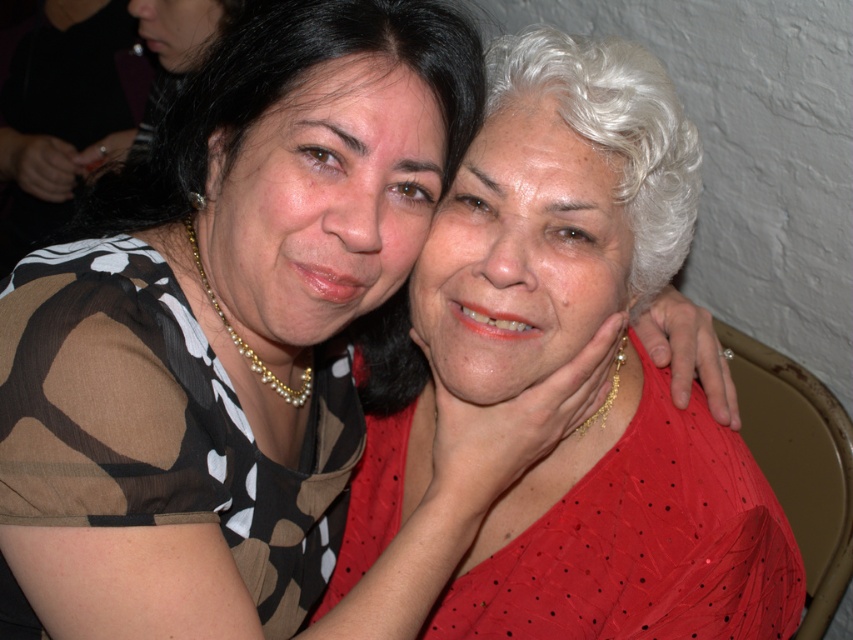
You are a photographer trying to decide where to place a bouquet of flowers in the scene. You want to place it between the brown printed fabric dress at upper left and the red sheer dress at center. Where should you position the bouquet so it is closer to the woman on the right?

The bouquet should be placed closer to the red sheer dress at center since it is positioned on the right side of the brown printed fabric dress at upper left.

Looking at this image, you are a photographer adjusting the focus on your camera. You need to ensure that both points, point (13, 344) and point (393, 449), are in sharp focus. Which point should you focus on first to ensure the closest one is properly focused?

You should focus on point (13, 344) first because it is closer to the viewer than point (393, 449), ensuring proper focus on the nearest point before adjusting for the farther one.